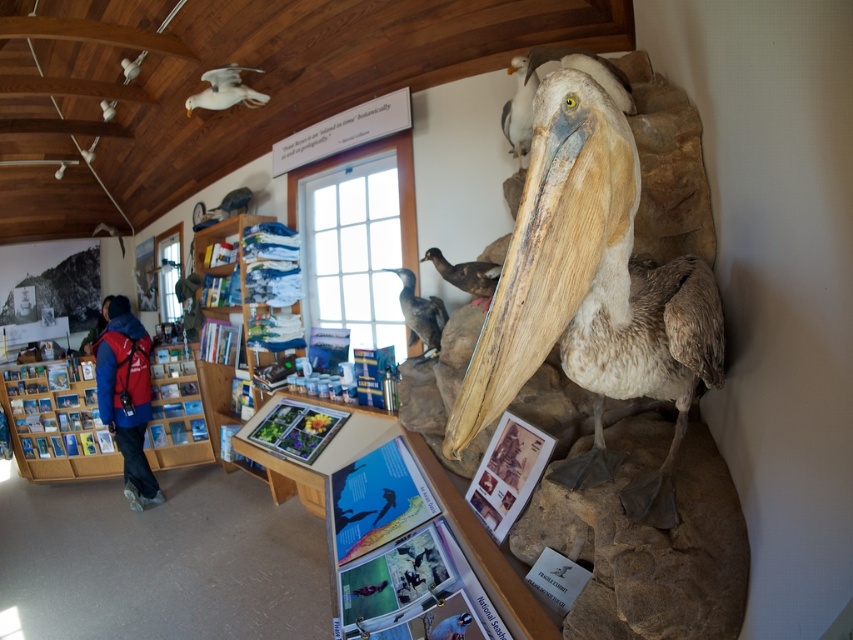
Question: Is blue glossy bird at lower center to the left of white matte dove at upper left from the viewer's perspective?

Choices:
 (A) no
 (B) yes

Answer: (A)

Question: Which point is closer to the camera?

Choices:
 (A) brown matte duck at center
 (B) dark gray matte bird at center

Answer: (A)

Question: Which of the following is the closest to the observer?

Choices:
 (A) (262, 100)
 (B) (438, 349)
 (C) (146, 502)

Answer: (B)

Question: Based on their relative distances, which object is nearer to the white matte bird at upper left?

Choices:
 (A) blue glossy bird at lower center
 (B) brown feathered pelican at right
 (C) dark gray matte bird at center
 (D) brown matte duck at center

Answer: (C)

Question: Is red fleece jacket at lower left above white matte dove at upper left?

Choices:
 (A) no
 (B) yes

Answer: (A)

Question: Is red fleece jacket at lower left smaller than dark gray matte bird at center?

Choices:
 (A) yes
 (B) no

Answer: (B)